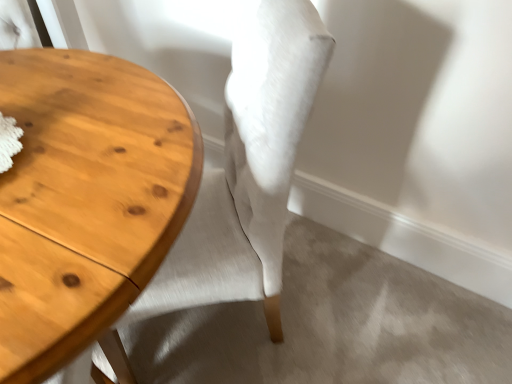
What do you see at coordinates (85, 199) in the screenshot?
I see `light brown wood table at left` at bounding box center [85, 199].

Locate an element on the screen. light brown wood table at left is located at coordinates (85, 199).

Describe the element at coordinates (248, 168) in the screenshot. I see `light beige fabric chair at center` at that location.

Find the location of a particular element. The image size is (512, 384). light beige fabric chair at center is located at coordinates (248, 168).

What are the coordinates of `light brown wood table at left` in the screenshot? It's located at (85, 199).

Does light beige fabric chair at center appear on the left side of light brown wood table at left?

No, light beige fabric chair at center is not to the left of light brown wood table at left.

Which object is more forward, light beige fabric chair at center or light brown wood table at left?

light brown wood table at left is in front.

Considering the positions of points (205, 285) and (34, 359), is point (205, 285) closer to camera compared to point (34, 359)?

No, it is not.

From the image's perspective, which object appears higher, light beige fabric chair at center or light brown wood table at left?

light beige fabric chair at center appears higher in the image.

Based on the photo, from a real-world perspective, relative to light brown wood table at left, is light beige fabric chair at center vertically above or below?

light beige fabric chair at center is above light brown wood table at left.

Looking at their sizes, would you say light beige fabric chair at center is wider or thinner than light brown wood table at left?

light beige fabric chair at center is thinner than light brown wood table at left.

From their relative heights in the image, would you say light beige fabric chair at center is taller or shorter than light brown wood table at left?

light beige fabric chair at center is taller than light brown wood table at left.

Is light beige fabric chair at center bigger or smaller than light brown wood table at left?

Considering their sizes, light beige fabric chair at center takes up less space than light brown wood table at left.

Would you say light beige fabric chair at center is inside or outside light brown wood table at left?

light beige fabric chair at center is located inside light brown wood table at left.

Is light beige fabric chair at center far away from light brown wood table at left?

They are positioned close to each other.

Is light beige fabric chair at center turned away from light brown wood table at left?

That's right, light beige fabric chair at center is facing away from light brown wood table at left.

Where is `table lying on the left of light beige fabric chair at center`? table lying on the left of light beige fabric chair at center is located at coordinates (85, 199).

Looking at this image, considering the relative positions of light brown wood table at left and light beige fabric chair at center in the image provided, is light brown wood table at left to the left of light beige fabric chair at center from the viewer's perspective?

Indeed, light brown wood table at left is positioned on the left side of light beige fabric chair at center.

Is light brown wood table at left in front of or behind light beige fabric chair at center in the image?

light brown wood table at left is positioned closer to the viewer than light beige fabric chair at center.

Considering the points (31, 125) and (286, 206), which point is behind, point (31, 125) or point (286, 206)?

The point (286, 206) is more distant.

From the image's perspective, which one is positioned higher, light brown wood table at left or light beige fabric chair at center?

light beige fabric chair at center is shown above in the image.

From a real-world perspective, is light brown wood table at left below light beige fabric chair at center?

Indeed, from a real-world perspective, light brown wood table at left is positioned beneath light beige fabric chair at center.

Between light brown wood table at left and light beige fabric chair at center, which one has smaller width?

light beige fabric chair at center.

Based on the photo, in terms of height, does light brown wood table at left look taller or shorter compared to light beige fabric chair at center?

In the image, light brown wood table at left appears to be shorter than light beige fabric chair at center.

Based on their sizes in the image, would you say light brown wood table at left is bigger or smaller than light beige fabric chair at center?

In the image, light brown wood table at left appears to be larger than light beige fabric chair at center.

Which is correct: light brown wood table at left is inside light beige fabric chair at center, or outside of it?

light brown wood table at left cannot be found inside light beige fabric chair at center.

Looking at this image, are light brown wood table at left and light beige fabric chair at center far apart?

That's not correct — light brown wood table at left is a little close to light beige fabric chair at center.

Is light brown wood table at left facing away from light beige fabric chair at center?

Yes, light brown wood table at left's orientation is away from light beige fabric chair at center.

What's the angular difference between light brown wood table at left and light beige fabric chair at center's facing directions?

55.4 degrees.

The width and height of the screenshot is (512, 384). In the image, there is a light beige fabric chair at center. Identify the location of table below it (from a real-world perspective). (85, 199).

The image size is (512, 384). In the image, there is a light beige fabric chair at center. In order to click on table below it (from the image's perspective) in this screenshot , I will do `click(85, 199)`.

At what (x,y) coordinates should I click in order to perform the action: click on chair that is above the light brown wood table at left (from a real-world perspective). Please return your answer as a coordinate pair (x, y). The height and width of the screenshot is (384, 512). Looking at the image, I should click on (248, 168).